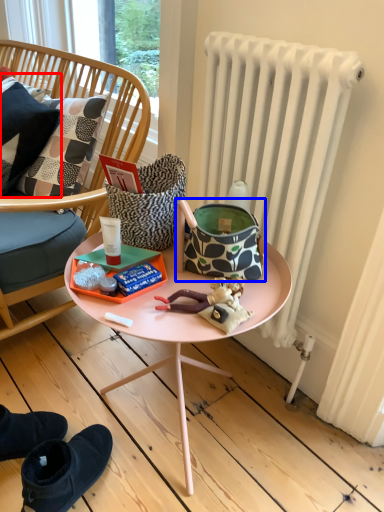
Question: Among these objects, which one is farthest to the camera, pillow (highlighted by a red box) or handbag (highlighted by a blue box)?

Choices:
 (A) pillow
 (B) handbag

Answer: (A)